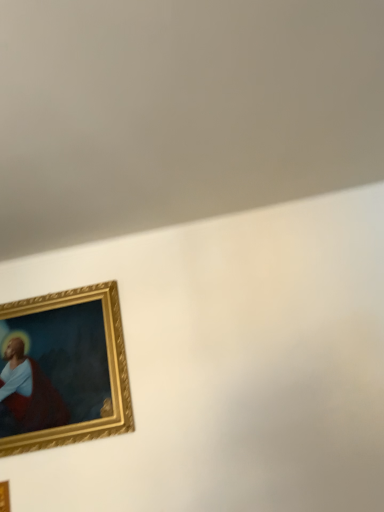
Question: Should I look upward or downward to see gold wooden picture frame at lower left, positioned as the first picture frame in front-to-back order?

Choices:
 (A) down
 (B) up

Answer: (A)

Question: Is gold wooden picture frame at lower left, the first picture frame in the bottom-to-top sequence, completely or partially outside of gold/gilded picture frame at lower left, placed as the 1th picture frame when sorted from back to front?

Choices:
 (A) no
 (B) yes

Answer: (B)

Question: Can you confirm if gold wooden picture frame at lower left, positioned as the first picture frame in front-to-back order, is shorter than gold/gilded picture frame at lower left, the 2th picture frame positioned from the front?

Choices:
 (A) no
 (B) yes

Answer: (B)

Question: Is gold wooden picture frame at lower left, positioned as the first picture frame in front-to-back order, closer to the viewer compared to gold/gilded picture frame at lower left, which is counted as the first picture frame, starting from the top?

Choices:
 (A) no
 (B) yes

Answer: (B)

Question: From a real-world perspective, does gold wooden picture frame at lower left, positioned as the second picture frame in back-to-front order, stand above gold/gilded picture frame at lower left, marked as the second picture frame in a bottom-to-top arrangement?

Choices:
 (A) yes
 (B) no

Answer: (B)

Question: Considering the relative sizes of gold wooden picture frame at lower left, which ranks as the 2th picture frame in top-to-bottom order, and gold/gilded picture frame at lower left, placed as the 1th picture frame when sorted from back to front, in the image provided, is gold wooden picture frame at lower left, which ranks as the 2th picture frame in top-to-bottom order, wider than gold/gilded picture frame at lower left, placed as the 1th picture frame when sorted from back to front,?

Choices:
 (A) no
 (B) yes

Answer: (A)

Question: Is gold/gilded picture frame at lower left, marked as the second picture frame in a bottom-to-top arrangement, at the back of gold wooden picture frame at lower left, the first picture frame in the bottom-to-top sequence?

Choices:
 (A) yes
 (B) no

Answer: (B)

Question: Does gold/gilded picture frame at lower left, marked as the second picture frame in a bottom-to-top arrangement, contain gold wooden picture frame at lower left, positioned as the second picture frame in back-to-front order?

Choices:
 (A) yes
 (B) no

Answer: (B)

Question: Is the position of gold/gilded picture frame at lower left, marked as the second picture frame in a bottom-to-top arrangement, more distant than that of gold wooden picture frame at lower left, which ranks as the 2th picture frame in top-to-bottom order?

Choices:
 (A) no
 (B) yes

Answer: (B)

Question: Considering the relative sizes of gold/gilded picture frame at lower left, the 2th picture frame positioned from the front, and gold wooden picture frame at lower left, which ranks as the 2th picture frame in top-to-bottom order, in the image provided, is gold/gilded picture frame at lower left, the 2th picture frame positioned from the front, thinner than gold wooden picture frame at lower left, which ranks as the 2th picture frame in top-to-bottom order,?

Choices:
 (A) yes
 (B) no

Answer: (B)

Question: Is gold/gilded picture frame at lower left, which is counted as the first picture frame, starting from the top, positioned with its back to gold wooden picture frame at lower left, the first picture frame in the bottom-to-top sequence?

Choices:
 (A) no
 (B) yes

Answer: (A)

Question: Is gold/gilded picture frame at lower left, the 2th picture frame positioned from the front, in contact with gold wooden picture frame at lower left, the first picture frame in the bottom-to-top sequence?

Choices:
 (A) yes
 (B) no

Answer: (B)

Question: Considering the relative sizes of gold/gilded picture frame at lower left, which is counted as the first picture frame, starting from the top, and gold wooden picture frame at lower left, positioned as the second picture frame in back-to-front order, in the image provided, is gold/gilded picture frame at lower left, which is counted as the first picture frame, starting from the top, smaller than gold wooden picture frame at lower left, positioned as the second picture frame in back-to-front order,?

Choices:
 (A) no
 (B) yes

Answer: (A)

Question: Based on their positions, is gold wooden picture frame at lower left, positioned as the second picture frame in back-to-front order, located to the left or right of gold/gilded picture frame at lower left, which is counted as the first picture frame, starting from the top?

Choices:
 (A) right
 (B) left

Answer: (B)